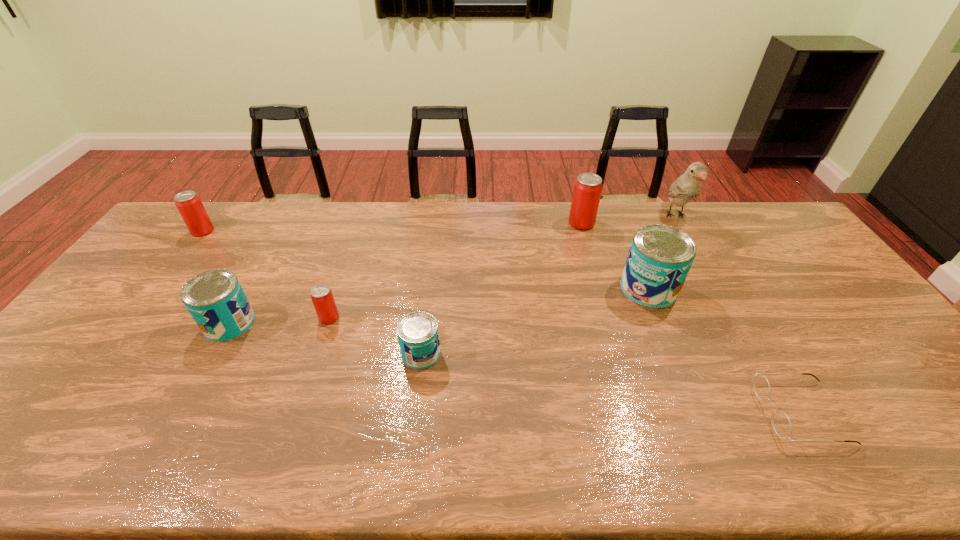
You are a GUI agent. You are given a task and a screenshot of the screen. Output one action in this format:
    pyautogui.click(x=<x>, y=<y>)
    Task: Click on the tallest object
    The width and height of the screenshot is (960, 540).
    Given the screenshot: What is the action you would take?
    pyautogui.click(x=686, y=187)

Locate an element on the screen. white bird is located at coordinates (686, 187).

You are a GUI agent. You are given a task and a screenshot of the screen. Output one action in this format:
    pyautogui.click(x=<x>, y=<y>)
    Task: Click on the rightmost can
    The image size is (960, 540).
    Given the screenshot: What is the action you would take?
    pyautogui.click(x=660, y=256)

At what (x,y) coordinates should I click in order to perform the action: click on the biggest blue can. Please return your answer as a coordinate pair (x, y). Looking at the image, I should click on (660, 256).

You are a GUI agent. You are given a task and a screenshot of the screen. Output one action in this format:
    pyautogui.click(x=<x>, y=<y>)
    Task: Click on the fourth object from right to left
    
    Given the screenshot: What is the action you would take?
    pyautogui.click(x=587, y=190)

Locate an element on the screen. The width and height of the screenshot is (960, 540). the second can from right to left is located at coordinates (587, 190).

This screenshot has height=540, width=960. In order to click on the second smallest red can in this screenshot , I will do `click(188, 203)`.

What are the coordinates of `the leftmost can` in the screenshot? It's located at (188, 203).

You are a GUI agent. You are given a task and a screenshot of the screen. Output one action in this format:
    pyautogui.click(x=<x>, y=<y>)
    Task: Click on the second biggest blue can
    
    Given the screenshot: What is the action you would take?
    pyautogui.click(x=215, y=299)

You are a GUI agent. You are given a task and a screenshot of the screen. Output one action in this format:
    pyautogui.click(x=<x>, y=<y>)
    Task: Click on the second can from left to right
    
    Given the screenshot: What is the action you would take?
    pyautogui.click(x=215, y=299)